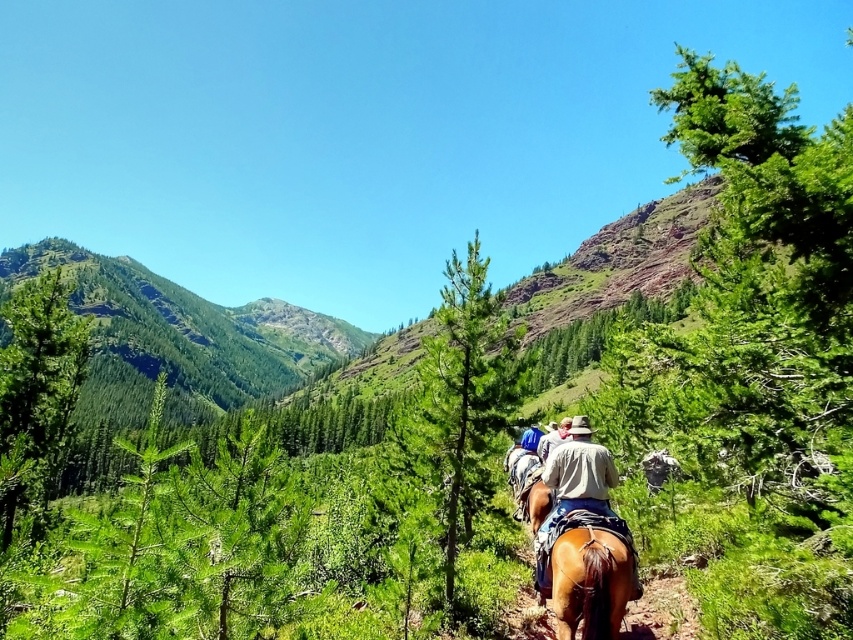
Question: Among these objects, which one is farthest from the camera?

Choices:
 (A) brown leather horse at center
 (B) light brown leather jacket at center

Answer: (B)

Question: Does brown leather horse at center appear over light brown leather jacket at center?

Choices:
 (A) no
 (B) yes

Answer: (A)

Question: Observing the image, what is the correct spatial positioning of brown leather horse at center in reference to light brown leather jacket at center?

Choices:
 (A) left
 (B) right

Answer: (A)

Question: Is brown leather horse at center below light brown leather jacket at center?

Choices:
 (A) yes
 (B) no

Answer: (A)

Question: Which point is closer to the camera?

Choices:
 (A) light brown leather jacket at center
 (B) brown leather horse at center

Answer: (B)